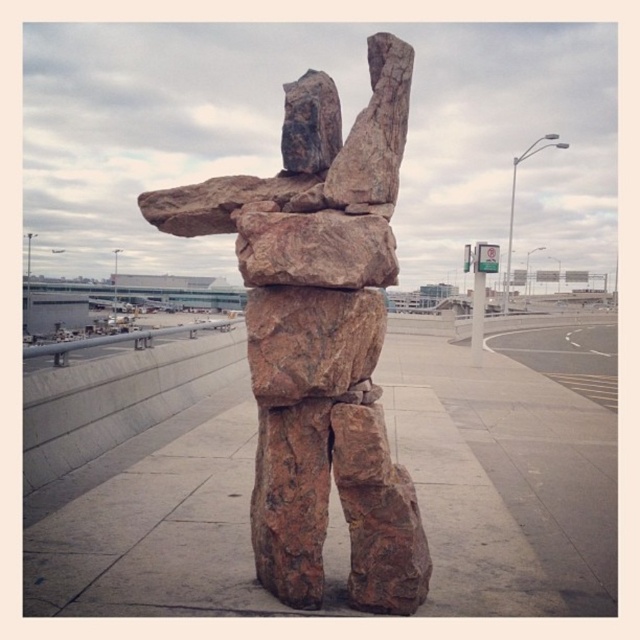
Measure the distance between brown stone pavement at center and brown rock sculpture at center.

brown stone pavement at center and brown rock sculpture at center are 3.18 meters apart from each other.

Based on the photo, which is below, brown stone pavement at center or brown rock sculpture at center?

brown stone pavement at center is lower down.

Who is more forward, (170, 524) or (296, 451)?

Point (296, 451) is more forward.

What are the coordinates of `brown stone pavement at center` in the screenshot? It's located at (504, 481).